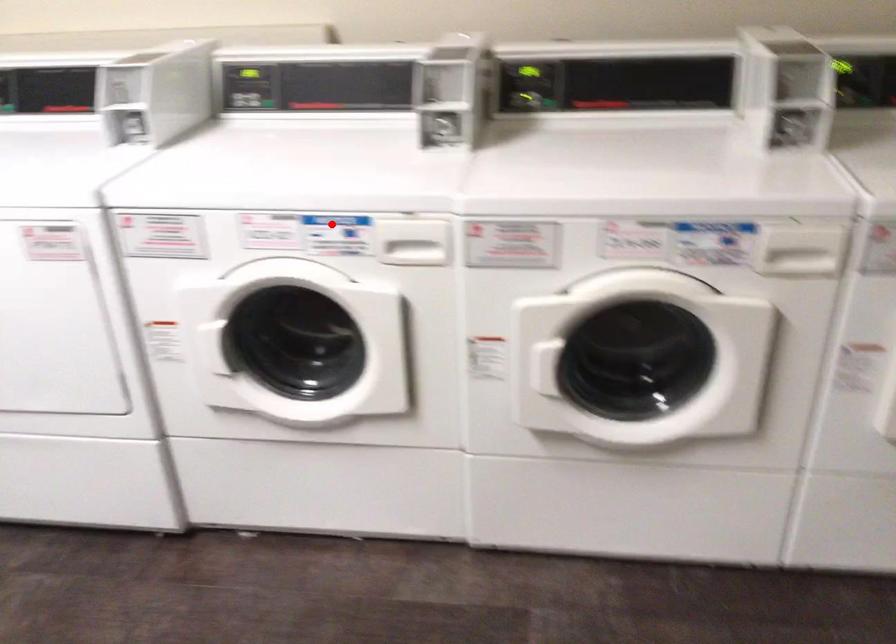
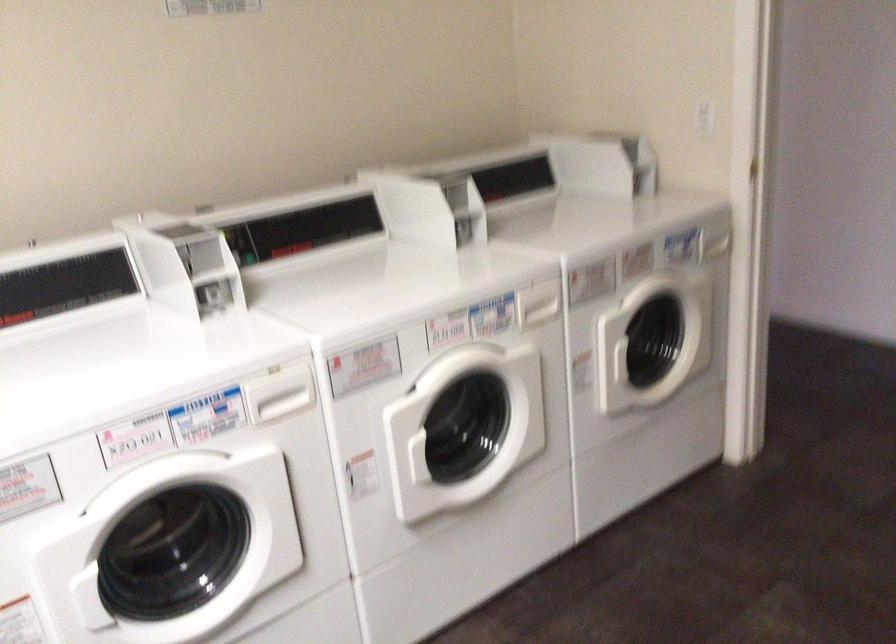
Find the pixel in the second image that matches the highlighted location in the first image.

(200, 406)